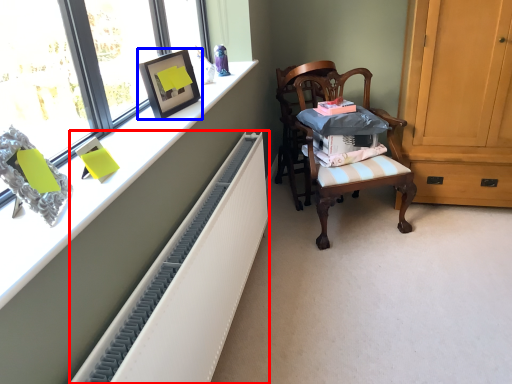
Question: Which object appears closest to the camera in this image, radiator (highlighted by a red box) or picture frame (highlighted by a blue box)?

Choices:
 (A) radiator
 (B) picture frame

Answer: (A)